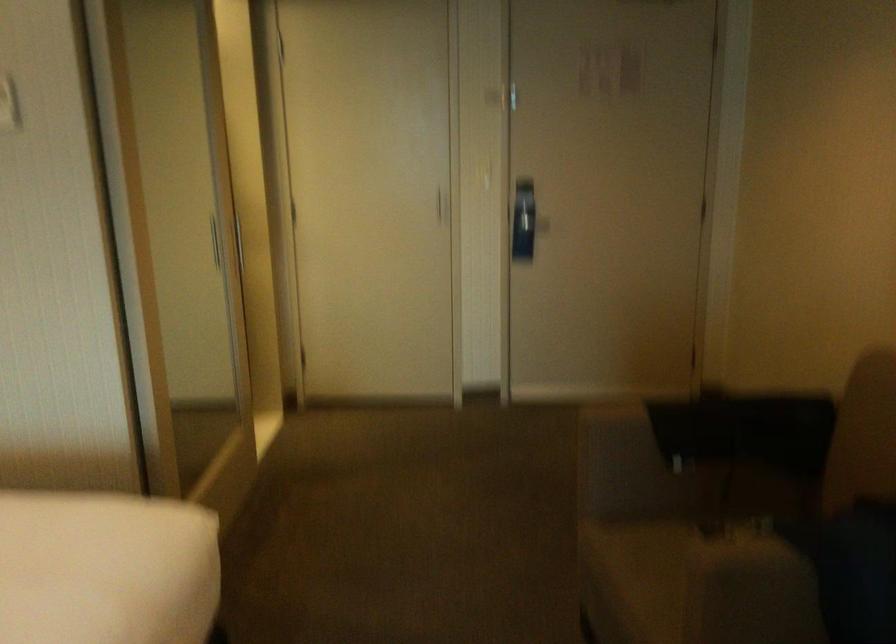
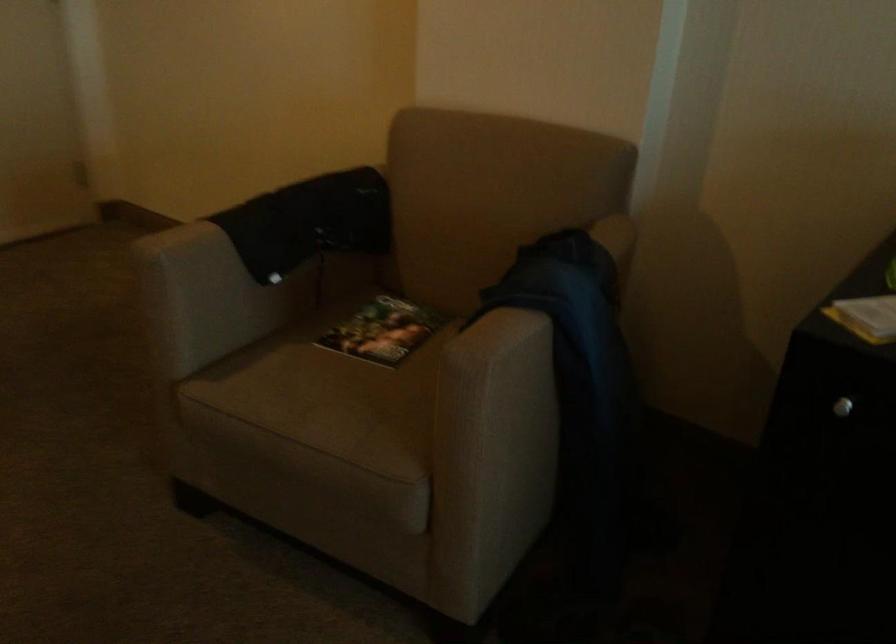
In the second image, find the point that corresponds to pixel 617 422 in the first image.

(201, 243)